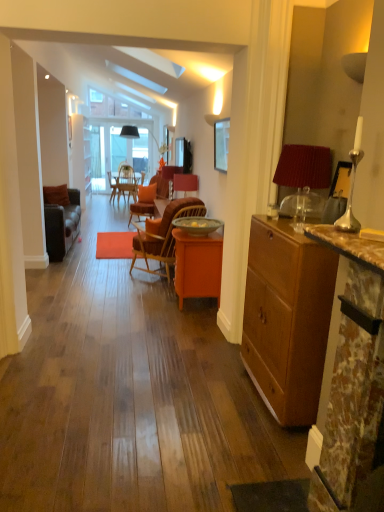
Question: Is velvet orange chair at center, the second chair in the front-to-back sequence, shorter than orange wood desk at center?

Choices:
 (A) no
 (B) yes

Answer: (B)

Question: Is velvet orange chair at center, the second chair in the front-to-back sequence, directly adjacent to orange wood desk at center?

Choices:
 (A) yes
 (B) no

Answer: (B)

Question: From a real-world perspective, is velvet orange chair at center, which is counted as the first chair, starting from the back, below orange wood desk at center?

Choices:
 (A) no
 (B) yes

Answer: (A)

Question: Is orange wood desk at center surrounded by velvet orange chair at center, which is the second chair from bottom to top?

Choices:
 (A) no
 (B) yes

Answer: (A)

Question: Is orange wood desk at center at the back of velvet orange chair at center, the second chair in the front-to-back sequence?

Choices:
 (A) no
 (B) yes

Answer: (A)

Question: Can you confirm if velvet orange chair at center, the second chair in the front-to-back sequence, is thinner than orange wood desk at center?

Choices:
 (A) yes
 (B) no

Answer: (A)

Question: Is the surface of orange wood desk at center in direct contact with brown marble fireplace at right?

Choices:
 (A) yes
 (B) no

Answer: (B)

Question: From the image's perspective, is orange wood desk at center located above brown marble fireplace at right?

Choices:
 (A) yes
 (B) no

Answer: (B)

Question: Is orange wood desk at center in front of brown marble fireplace at right?

Choices:
 (A) no
 (B) yes

Answer: (A)

Question: Considering the relative positions of orange wood desk at center and brown marble fireplace at right in the image provided, is orange wood desk at center to the right of brown marble fireplace at right from the viewer's perspective?

Choices:
 (A) yes
 (B) no

Answer: (B)

Question: Is orange wood desk at center oriented towards brown marble fireplace at right?

Choices:
 (A) no
 (B) yes

Answer: (A)

Question: Is orange wood desk at center smaller than brown marble fireplace at right?

Choices:
 (A) yes
 (B) no

Answer: (B)